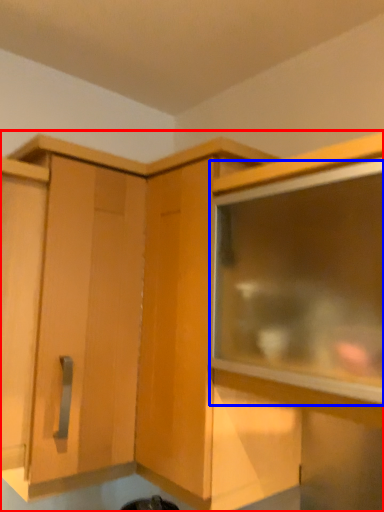
Question: Which object is further to the camera taking this photo, cabinetry (highlighted by a red box) or window (highlighted by a blue box)?

Choices:
 (A) cabinetry
 (B) window

Answer: (A)